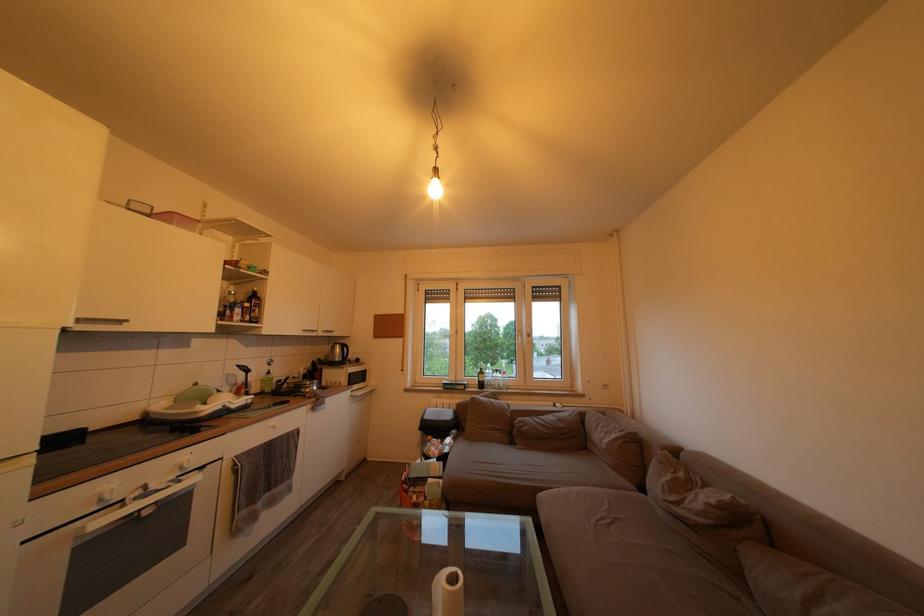
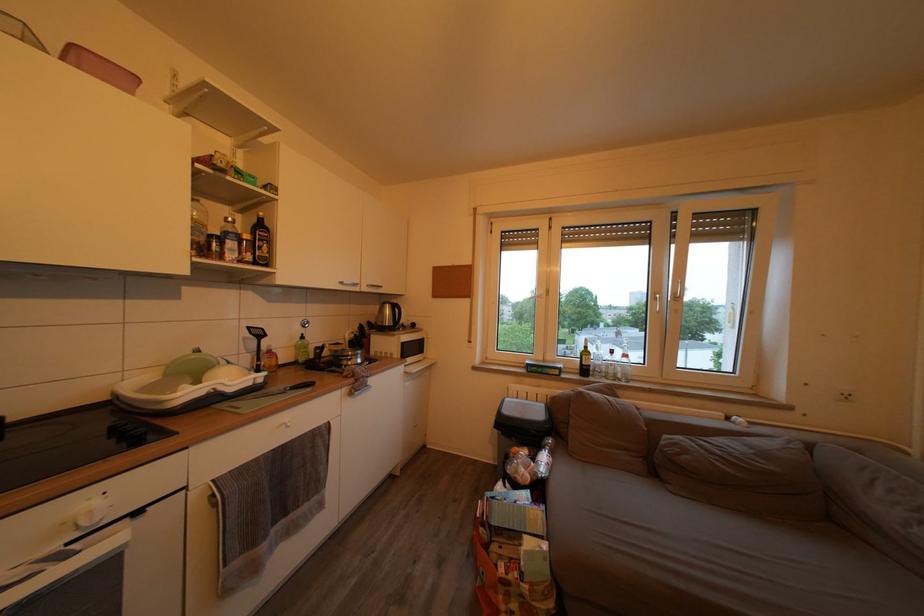
Find the pixel in the second image that matches (497,385) in the first image.

(608, 369)